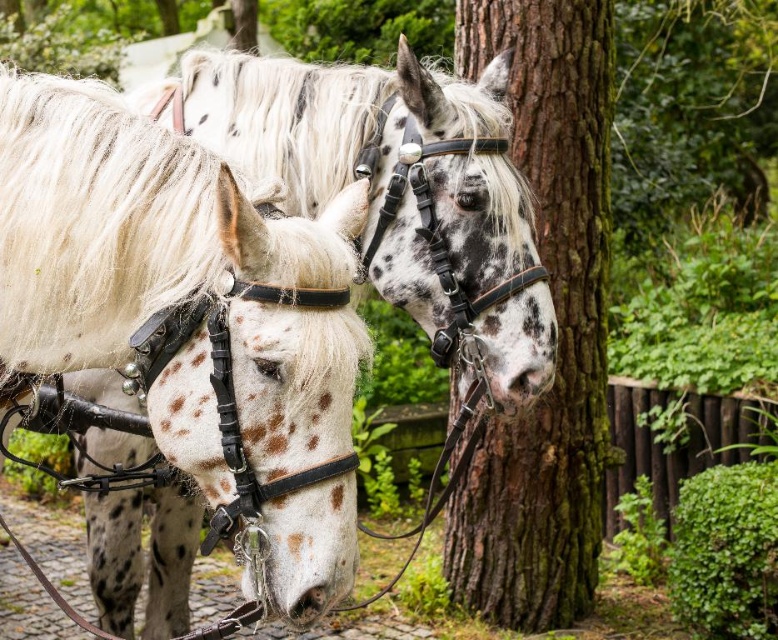
Between spotted white horse at left and brown rough bark tree at center, which one is positioned lower?

Positioned lower is brown rough bark tree at center.

Is point (316, 428) positioned behind point (570, 58)?

No, (316, 428) is in front of (570, 58).

Locate an element on the screen. spotted white horse at left is located at coordinates pyautogui.click(x=170, y=264).

Does speckled leather horse at center have a larger size compared to brown rough bark tree at center?

Incorrect, speckled leather horse at center is not larger than brown rough bark tree at center.

Who is higher up, speckled leather horse at center or brown rough bark tree at center?

speckled leather horse at center is higher up.

You are a GUI agent. You are given a task and a screenshot of the screen. Output one action in this format:
    pyautogui.click(x=<x>, y=<y>)
    Task: Click on the speckled leather horse at center
    
    Given the screenshot: What is the action you would take?
    pyautogui.click(x=370, y=157)

What do you see at coordinates (556, 324) in the screenshot? I see `brown rough bark tree at center` at bounding box center [556, 324].

Is point (573, 483) farther from camera compared to point (338, 68)?

Yes, it is behind point (338, 68).

Identify the location of brown rough bark tree at center. (556, 324).